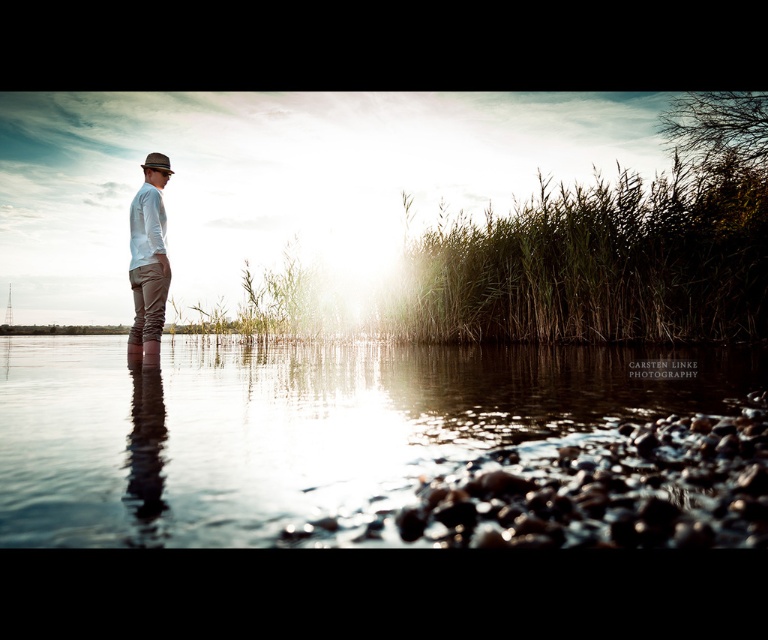
Question: Which point is closer to the camera?

Choices:
 (A) matte white shirt at center
 (B) matte brown fedora at left
 (C) clear water at center

Answer: (C)

Question: Which point is closer to the camera taking this photo?

Choices:
 (A) (151, 188)
 (B) (419, 372)
 (C) (151, 152)

Answer: (B)

Question: Estimate the real-world distances between objects in this image. Which object is closer to the clear water at center?

Choices:
 (A) matte white shirt at center
 (B) matte brown fedora at left

Answer: (A)

Question: Does clear water at center lie in front of matte white shirt at center?

Choices:
 (A) yes
 (B) no

Answer: (A)

Question: Is clear water at center above matte brown fedora at left?

Choices:
 (A) no
 (B) yes

Answer: (A)

Question: Is clear water at center above matte white shirt at center?

Choices:
 (A) no
 (B) yes

Answer: (A)